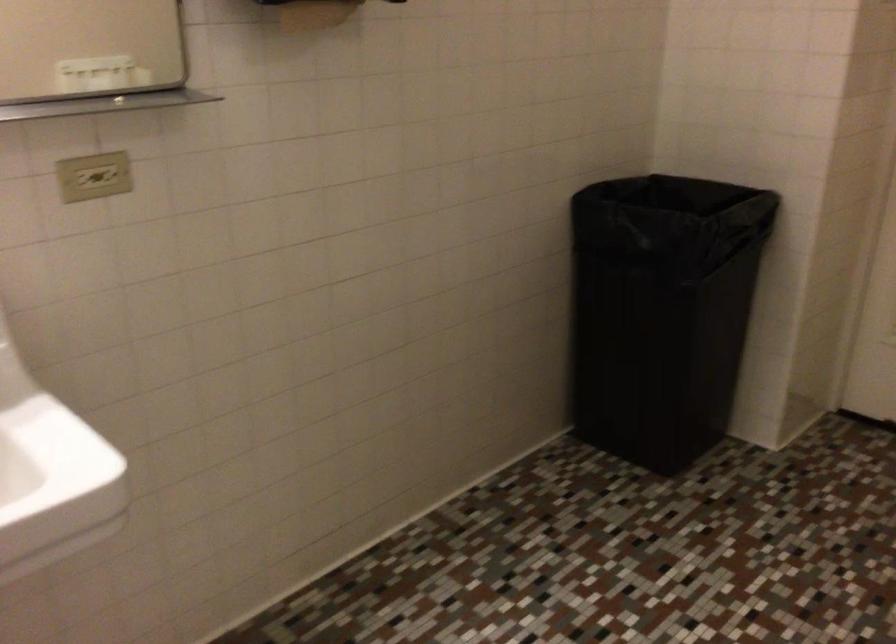
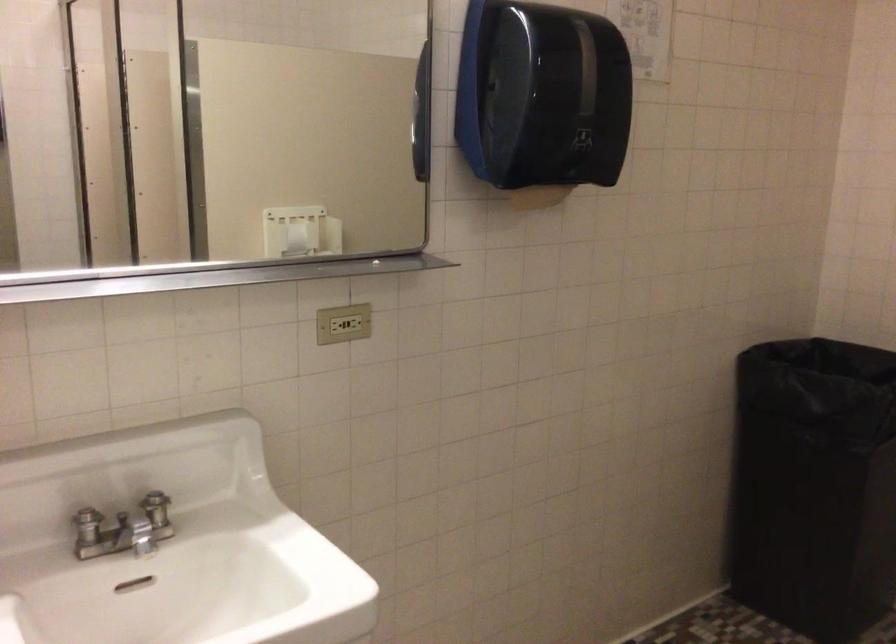
Which direction would the cameraman need to move to produce the second image?

The movement direction of the cameraman is left, backward.